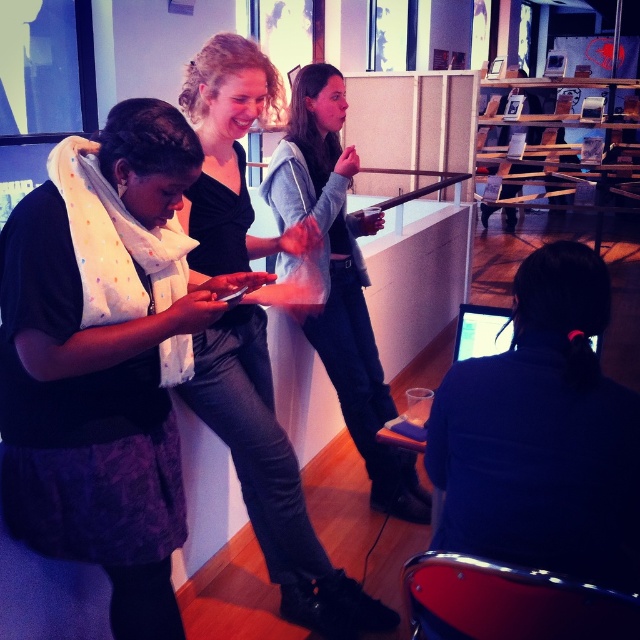
You are standing in the workspace and see two points marked in the image. Which point is closer to you, point (163, 564) or point (292, 547)?

Point (163, 564) is in front of point (292, 547), so it is closer to you.

You are an observer in the scene. You notice two items of clothing in the image. The first is the matte black scarf at left, and the second is the light gray sweater at center. Which of these items is positioned lower in the image?

The matte black scarf at left is located below the light gray sweater at center, so it is positioned lower in the image.

You are standing in the workspace and want to pick up the matte black scarf at left and the matte black sweater at upper center. Which item will you need to reach further to get?

The matte black sweater at upper center is further from the viewer than the matte black scarf at left, so you will need to reach further to get the matte black sweater at upper center.